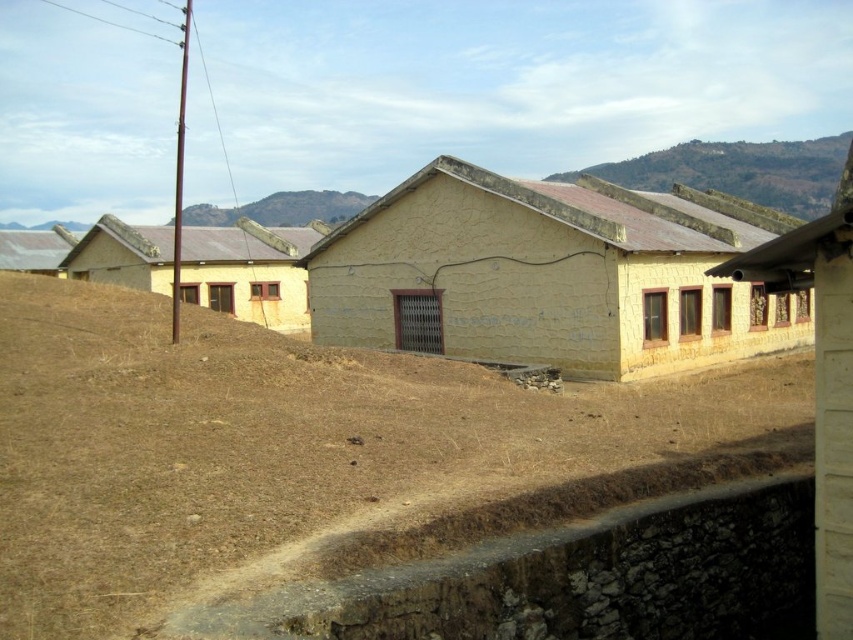
Is brown soil at center above brown rocky hill at upper center?

No.

Does brown soil at center have a greater height compared to brown rocky hill at upper center?

No, brown soil at center is not taller than brown rocky hill at upper center.

Does point (20, 392) come closer to viewer compared to point (222, 221)?

Yes, it is.

Where is `brown soil at center`? brown soil at center is located at coordinates (309, 452).

Consider the image. Does brown soil at center appear on the right side of metallic corrugated roof at left?

Correct, you'll find brown soil at center to the right of metallic corrugated roof at left.

Which is in front, point (114, 611) or point (53, 230)?

Point (114, 611) is more forward.

Is point (312, 486) positioned before point (33, 272)?

Yes, it is in front of point (33, 272).

Image resolution: width=853 pixels, height=640 pixels. What are the coordinates of `brown soil at center` in the screenshot? It's located at (309, 452).

Does matte yellow building at center have a lesser width compared to metallic corrugated roof at left?

Yes.

Does matte yellow building at center have a greater width compared to metallic corrugated roof at left?

In fact, matte yellow building at center might be narrower than metallic corrugated roof at left.

Between point (700, 307) and point (38, 268), which one is positioned behind?

The point (38, 268) is more distant.

What are the coordinates of `matte yellow building at center` in the screenshot? It's located at (550, 275).